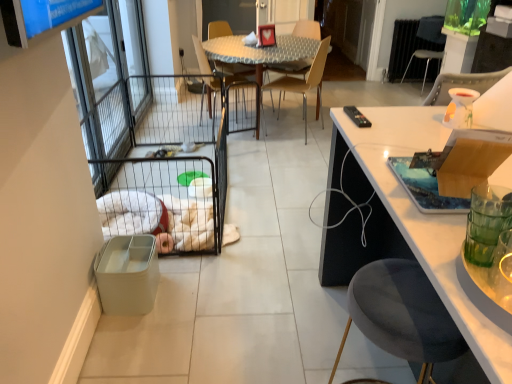
Where is `wooden cutting board at right`? The height and width of the screenshot is (384, 512). wooden cutting board at right is located at coordinates (425, 188).

What do you see at coordinates (201, 56) in the screenshot?
I see `metallic silver chair at center, acting as the fourth chair starting from the right` at bounding box center [201, 56].

Measure the distance between clear glass screen door at left and camera.

clear glass screen door at left and camera are 9.57 feet apart from each other.

What is the approximate width of metallic silver chair at upper right, arranged as the 4th chair when viewed from the front?

The width of metallic silver chair at upper right, arranged as the 4th chair when viewed from the front, is 22.08 inches.

Where is `matte plastic trash bin at lower left`? This screenshot has height=384, width=512. matte plastic trash bin at lower left is located at coordinates (127, 274).

Image resolution: width=512 pixels, height=384 pixels. What do you see at coordinates (127, 274) in the screenshot?
I see `matte plastic trash bin at lower left` at bounding box center [127, 274].

The height and width of the screenshot is (384, 512). I want to click on wooden cutting board at right, so click(x=425, y=188).

Between clear glass screen door at left and matte plastic trash bin at lower left, which one appears on the left side from the viewer's perspective?

clear glass screen door at left.

Identify the location of trash bin/can below the clear glass screen door at left (from the image's perspective). (127, 274).

Is the surface of clear glass screen door at left in direct contact with matte plastic trash bin at lower left?

No, clear glass screen door at left is not making contact with matte plastic trash bin at lower left.

Does clear glass screen door at left have a smaller size compared to matte plastic trash bin at lower left?

Incorrect, clear glass screen door at left is not smaller in size than matte plastic trash bin at lower left.

Is metallic patterned table at center not close to metallic silver chair at center, the 3th chair when ordered from front to back?

No, metallic patterned table at center is not far from metallic silver chair at center, the 3th chair when ordered from front to back.

Is metallic patterned table at center outside of metallic silver chair at center, acting as the fourth chair starting from the right?

That's correct, metallic patterned table at center is outside of metallic silver chair at center, acting as the fourth chair starting from the right.

Considering the relative sizes of metallic patterned table at center and metallic silver chair at center, which is counted as the 2th chair, starting from the back, in the image provided, is metallic patterned table at center smaller than metallic silver chair at center, which is counted as the 2th chair, starting from the back,?

Incorrect, metallic patterned table at center is not smaller in size than metallic silver chair at center, which is counted as the 2th chair, starting from the back.

Which of these two, metallic silver chair at upper right, which is the 4th chair in bottom-to-top order, or metallic silver chair at center, which ranks as the third chair in bottom-to-top order, stands taller?

metallic silver chair at center, which ranks as the third chair in bottom-to-top order, is taller.

From the image's perspective, which one is positioned higher, metallic silver chair at upper right, which is the 4th chair in bottom-to-top order, or metallic silver chair at center, which is counted as the 2th chair, starting from the back?

metallic silver chair at upper right, which is the 4th chair in bottom-to-top order, appears higher in the image.

Would you say metallic silver chair at upper right, which is the 1th chair in right-to-left order, is outside metallic silver chair at center, which is counted as the 2th chair, starting from the back?

metallic silver chair at upper right, which is the 1th chair in right-to-left order, lies outside metallic silver chair at center, which is counted as the 2th chair, starting from the back,'s area.

Is metallic silver chair at upper right, arranged as the 4th chair when viewed from the left, bigger or smaller than metallic silver chair at center, acting as the fourth chair starting from the right?

In the image, metallic silver chair at upper right, arranged as the 4th chair when viewed from the left, appears to be larger than metallic silver chair at center, acting as the fourth chair starting from the right.

Which is more to the right, wooden cutting board at right or metallic silver chair at upper right, marked as the first chair in a top-to-bottom arrangement?

From the viewer's perspective, metallic silver chair at upper right, marked as the first chair in a top-to-bottom arrangement, appears more on the right side.

Between wooden cutting board at right and metallic silver chair at upper right, marked as the first chair in a top-to-bottom arrangement, which one has larger size?

Bigger between the two is metallic silver chair at upper right, marked as the first chair in a top-to-bottom arrangement.

Is wooden cutting board at right surrounding metallic silver chair at upper right, which is the 4th chair in bottom-to-top order?

No, wooden cutting board at right does not contain metallic silver chair at upper right, which is the 4th chair in bottom-to-top order.

From the image's perspective, would you say wooden cutting board at right is shown under metallic silver chair at upper right, the first chair in the back-to-front sequence?

Correct, wooden cutting board at right appears lower than metallic silver chair at upper right, the first chair in the back-to-front sequence, in the image.

Looking at this image, would you say velvet grey bar stool at lower right, arranged as the 4th chair when viewed from the back, is part of light brown wood chair at center, the 3th chair from the right,'s contents?

No.

Consider the image. Who is more distant, light brown wood chair at center, the 2th chair viewed from the left, or velvet grey bar stool at lower right, arranged as the 4th chair when viewed from the back?

Positioned behind is light brown wood chair at center, the 2th chair viewed from the left.

From the image's perspective, is light brown wood chair at center, the 2th chair viewed from the left, positioned above or below velvet grey bar stool at lower right, arranged as the 4th chair when viewed from the back?

Clearly, from the image's perspective, light brown wood chair at center, the 2th chair viewed from the left, is above velvet grey bar stool at lower right, arranged as the 4th chair when viewed from the back.

Is light brown wood chair at center, marked as the 2th chair in a bottom-to-top arrangement, with velvet grey bar stool at lower right, the 1th chair viewed from the front?

light brown wood chair at center, marked as the 2th chair in a bottom-to-top arrangement, is not next to velvet grey bar stool at lower right, the 1th chair viewed from the front, and they're not touching.

Are metallic patterned table at center and metallic silver chair at upper right, marked as the first chair in a top-to-bottom arrangement, making contact?

No, metallic patterned table at center is not in contact with metallic silver chair at upper right, marked as the first chair in a top-to-bottom arrangement.

Considering the positions of objects metallic patterned table at center and metallic silver chair at upper right, the first chair in the back-to-front sequence, in the image provided, who is more to the right, metallic patterned table at center or metallic silver chair at upper right, the first chair in the back-to-front sequence,?

metallic silver chair at upper right, the first chair in the back-to-front sequence, is more to the right.

Could you tell me if metallic patterned table at center is turned towards metallic silver chair at upper right, arranged as the 4th chair when viewed from the front?

Yes, metallic patterned table at center faces towards metallic silver chair at upper right, arranged as the 4th chair when viewed from the front.

In the scene shown: From the image's perspective, between metallic patterned table at center and metallic silver chair at upper right, which is the 1th chair in right-to-left order, who is located below?

From the image's view, metallic patterned table at center is below.

From a real-world perspective, is metallic patterned table at center on top of light brown wood chair at center, which is the third chair in top-to-bottom order?

No, from a real-world perspective, metallic patterned table at center is not on top of light brown wood chair at center, which is the third chair in top-to-bottom order.

Find the location of `the 2nd chair in front of the metallic patterned table at center, counting from the anchor's position`. the 2nd chair in front of the metallic patterned table at center, counting from the anchor's position is located at coordinates (304, 83).

From the image's perspective, is metallic patterned table at center located above light brown wood chair at center, marked as the 2th chair in a bottom-to-top arrangement?

Yes, from the image's perspective, metallic patterned table at center is on top of light brown wood chair at center, marked as the 2th chair in a bottom-to-top arrangement.

The width and height of the screenshot is (512, 384). What are the coordinates of `trash bin/can in front of the clear glass screen door at left` in the screenshot? It's located at (127, 274).

The image size is (512, 384). I want to click on the 1st chair below the metallic patterned table at center (from the image's perspective), so click(201, 56).

Estimate the real-world distances between objects in this image. Which object is closer to clear glass screen door at left, metallic silver chair at upper right, the first chair in the back-to-front sequence, or wooden cutting board at right?

wooden cutting board at right is positioned closer to the anchor clear glass screen door at left.

Based on their spatial positions, is light brown wood chair at center, which is the third chair in top-to-bottom order, or metallic patterned table at center closer to wooden cutting board at right?

metallic patterned table at center.

Based on their spatial positions, is wooden cutting board at right or velvet grey bar stool at lower right, arranged as the 4th chair when viewed from the back, further from metallic silver chair at upper right, marked as the first chair in a top-to-bottom arrangement?

velvet grey bar stool at lower right, arranged as the 4th chair when viewed from the back, lies further to metallic silver chair at upper right, marked as the first chair in a top-to-bottom arrangement, than the other object.

Considering their positions, is velvet grey bar stool at lower right, which is the second chair in right-to-left order, positioned closer to metallic silver chair at upper right, arranged as the 4th chair when viewed from the left, than wooden cutting board at right?

Among the two, wooden cutting board at right is located nearer to metallic silver chair at upper right, arranged as the 4th chair when viewed from the left.

Looking at the image, which one is located further to matte plastic trash bin at lower left, wooden cutting board at right or metallic silver chair at upper right, the first chair in the back-to-front sequence?

metallic silver chair at upper right, the first chair in the back-to-front sequence, is further to matte plastic trash bin at lower left.

Which object lies nearer to the anchor point clear glass screen door at left, metallic silver chair at upper right, arranged as the 4th chair when viewed from the front, or matte plastic trash bin at lower left?

matte plastic trash bin at lower left is closer to clear glass screen door at left.

Which object lies nearer to the anchor point metallic silver chair at center, which is counted as the 2th chair, starting from the back, velvet grey bar stool at lower right, acting as the fourth chair starting from the top, or wooden cutting board at right?

The object closer to metallic silver chair at center, which is counted as the 2th chair, starting from the back, is wooden cutting board at right.

Looking at the image, which one is located further to wooden cutting board at right, clear glass screen door at left or light brown wood chair at center, which ranks as the second chair in front-to-back order?

light brown wood chair at center, which ranks as the second chair in front-to-back order, is further to wooden cutting board at right.

This screenshot has width=512, height=384. I want to click on trash bin/can between velvet grey bar stool at lower right, arranged as the 4th chair when viewed from the back, and metallic patterned table at center in the front-back direction, so click(x=127, y=274).

Locate an element on the screen. Image resolution: width=512 pixels, height=384 pixels. tableware between velvet grey bar stool at lower right, arranged as the first chair when ordered from the bottom, and metallic silver chair at center, which ranks as the third chair in bottom-to-top order, in the front-back direction is located at coordinates (425, 188).

Image resolution: width=512 pixels, height=384 pixels. I want to click on screen door located between wooden cutting board at right and metallic silver chair at center, which ranks as the third chair in bottom-to-top order, in the depth direction, so tap(104, 84).

Image resolution: width=512 pixels, height=384 pixels. I want to click on chair between velvet grey bar stool at lower right, acting as the fourth chair starting from the top, and metallic silver chair at center, the first chair when ordered from left to right, along the z-axis, so click(304, 83).